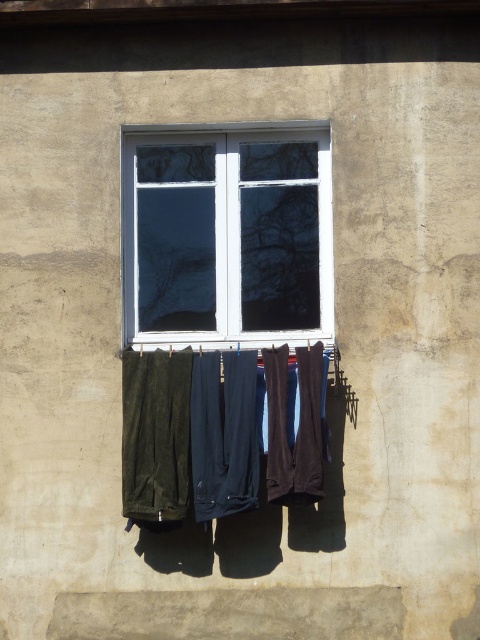
Can you confirm if white plastic window at center is positioned above velvet green pants at center?

Correct, white plastic window at center is located above velvet green pants at center.

Between white plastic window at center and velvet green pants at center, which one has more height?

white plastic window at center is taller.

Who is more forward, (273, 243) or (159, 454)?

Point (159, 454) is more forward.

This screenshot has width=480, height=640. I want to click on white plastic window at center, so click(x=228, y=237).